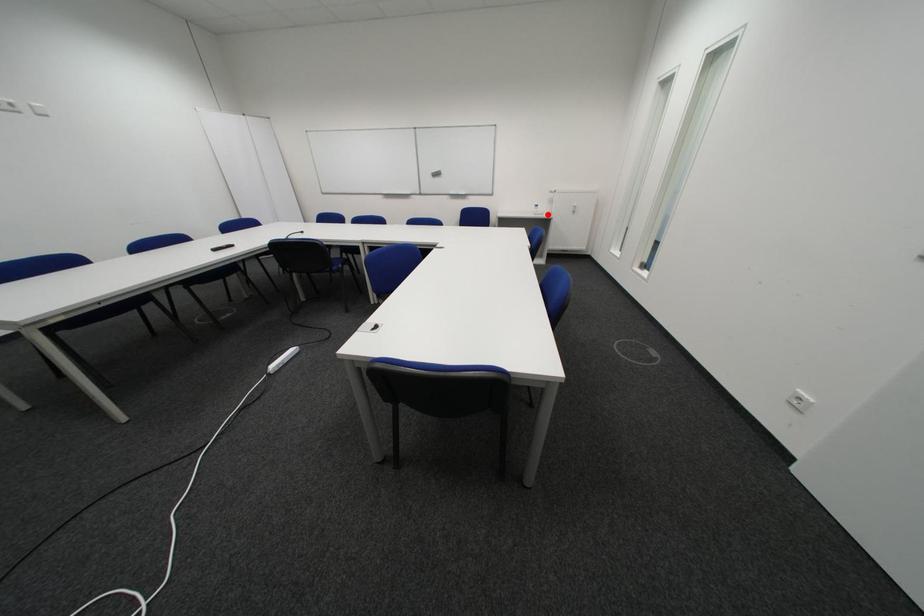
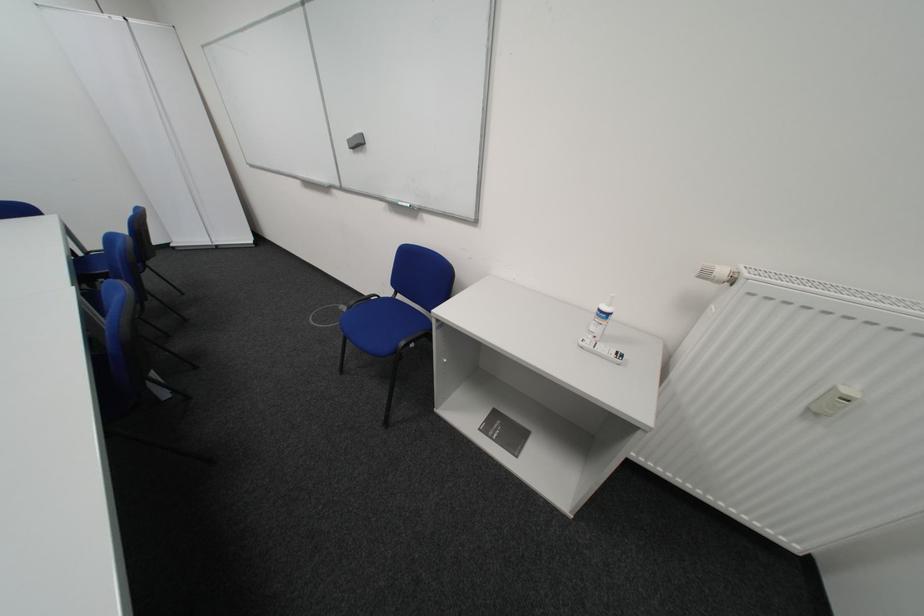
The point at the highlighted location is marked in the first image. Where is the corresponding point in the second image?

(599, 345)